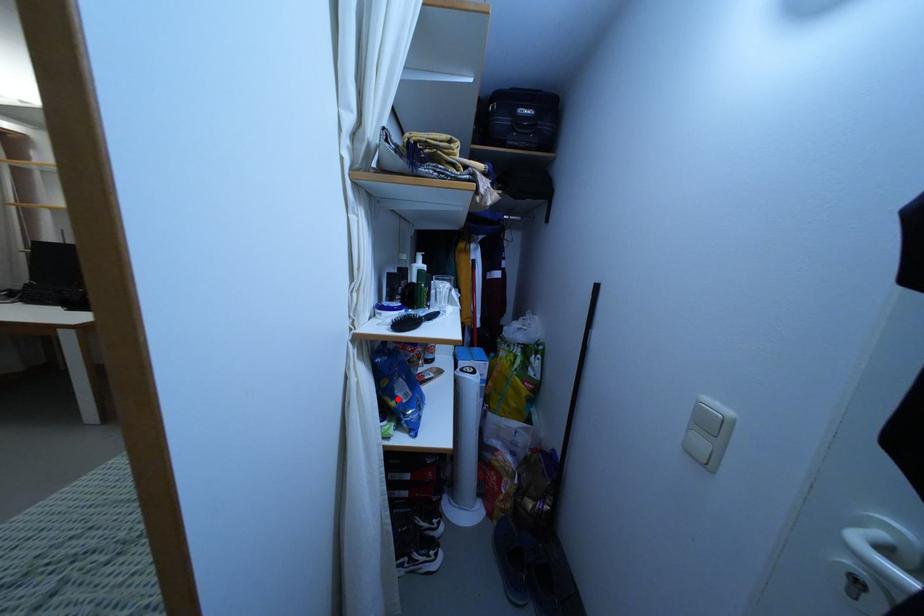
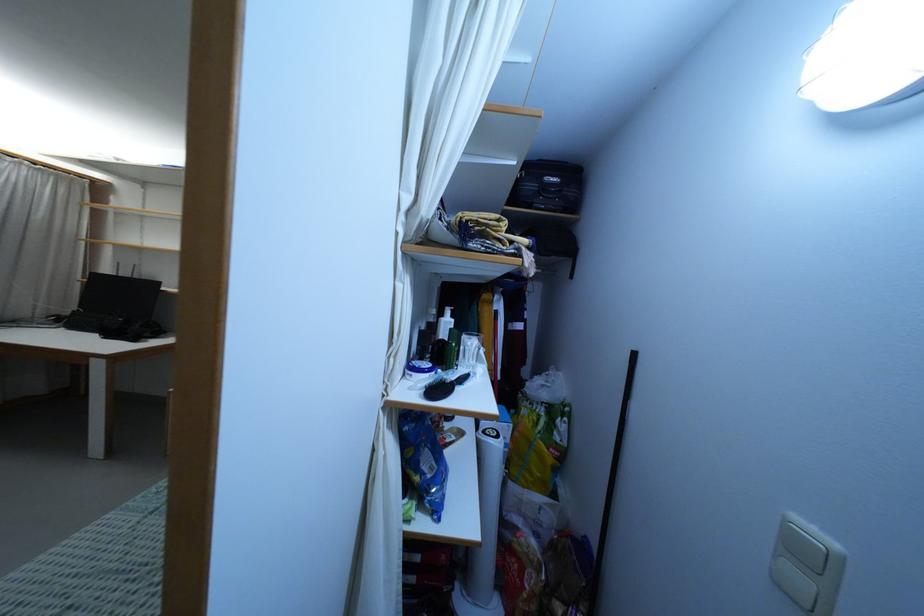
Question: I am providing you with two images of the same scene from different viewpoints. Given a red point in image1, look at the same physical point in image2. Is it:

Choices:
 (A) Closer to the viewpoint
 (B) Farther from the viewpoint

Answer: (B)